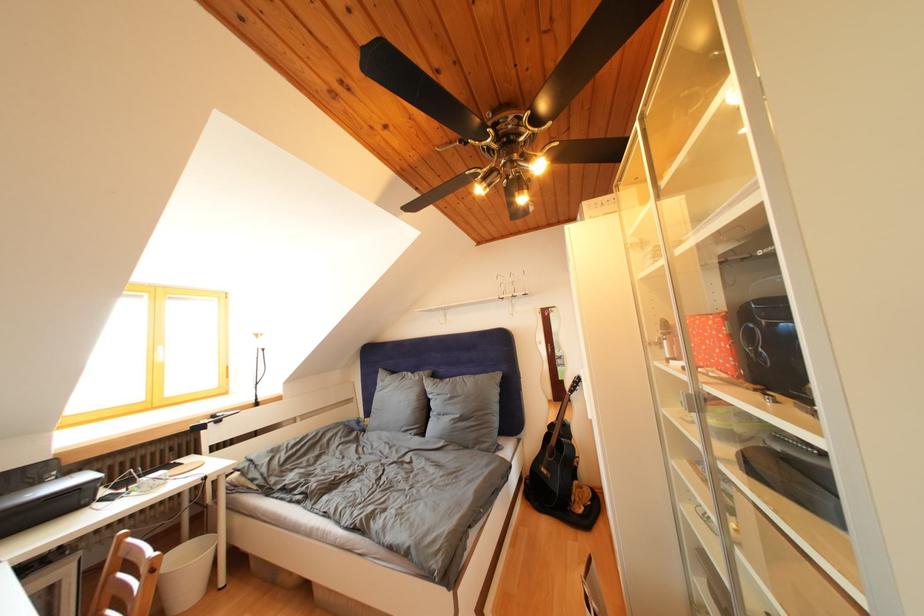
At what (x,y) coordinates should I click in order to perform the action: click on black case. Please return your answer as a coordinate pair (x, y). Looking at the image, I should click on (46, 501).